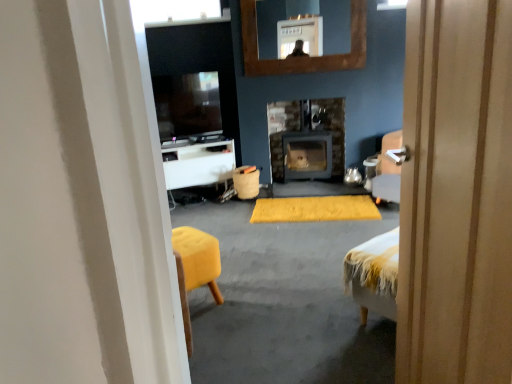
Question: Would you say matte black wood burning stove at center is to the left or to the right of burlap-like fabric trash can at center in the picture?

Choices:
 (A) right
 (B) left

Answer: (A)

Question: Considering their positions, is matte black wood burning stove at center located in front of or behind burlap-like fabric trash can at center?

Choices:
 (A) front
 (B) behind

Answer: (B)

Question: Estimate the real-world distances between objects in this image. Which object is farther from the matte black wood burning stove at center?

Choices:
 (A) wooden door at center
 (B) white glossy table at center
 (C) matte black tv at upper center
 (D) yellow fuzzy yoga mat at center
 (E) wooden-framed mirror at upper center

Answer: (A)

Question: Which is nearer to the wooden-framed mirror at upper center?

Choices:
 (A) matte black tv at upper center
 (B) yellow fuzzy yoga mat at center
 (C) white glossy table at center
 (D) transparent glass window at upper center
 (E) wooden door at center

Answer: (D)